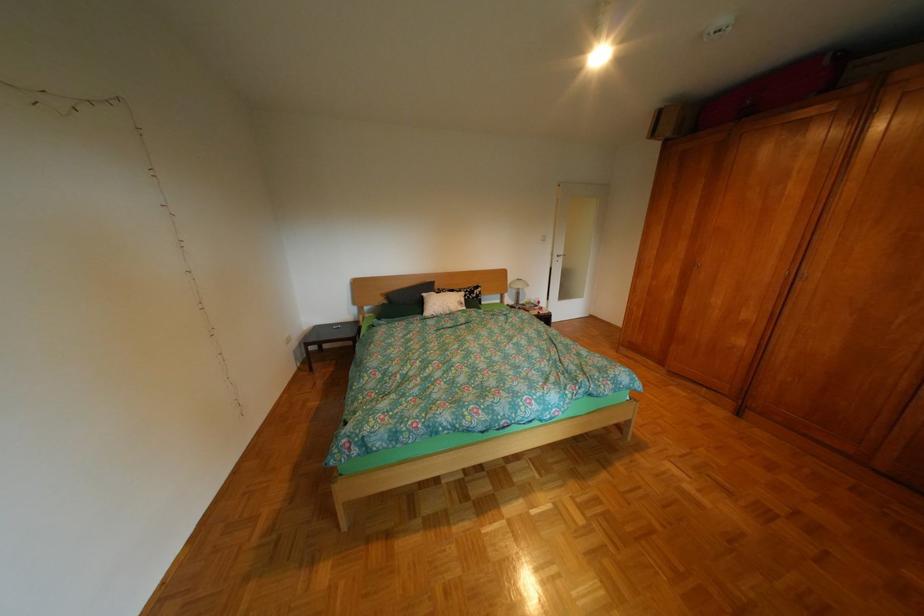
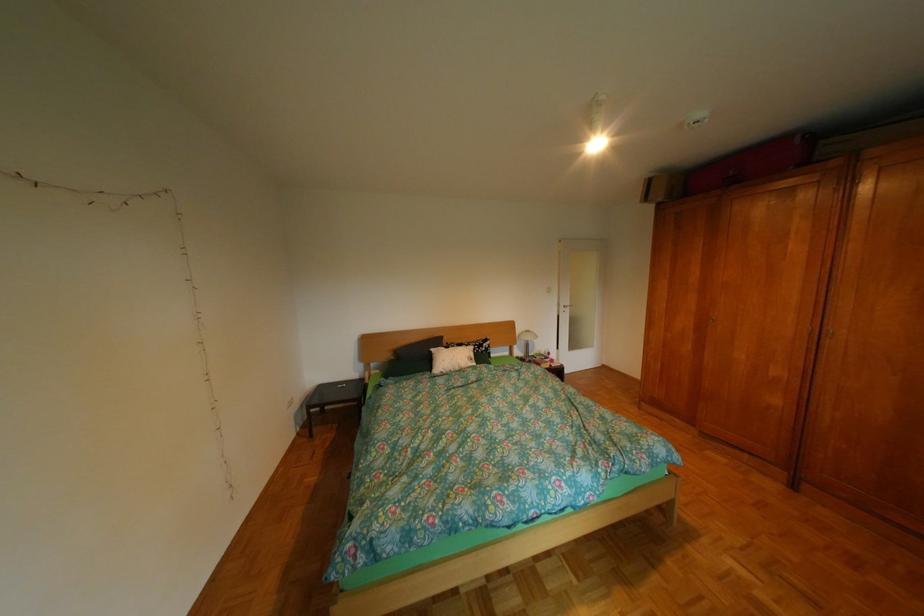
In the second image, find the point that corresponds to the point at 400,302 in the first image.

(407, 359)